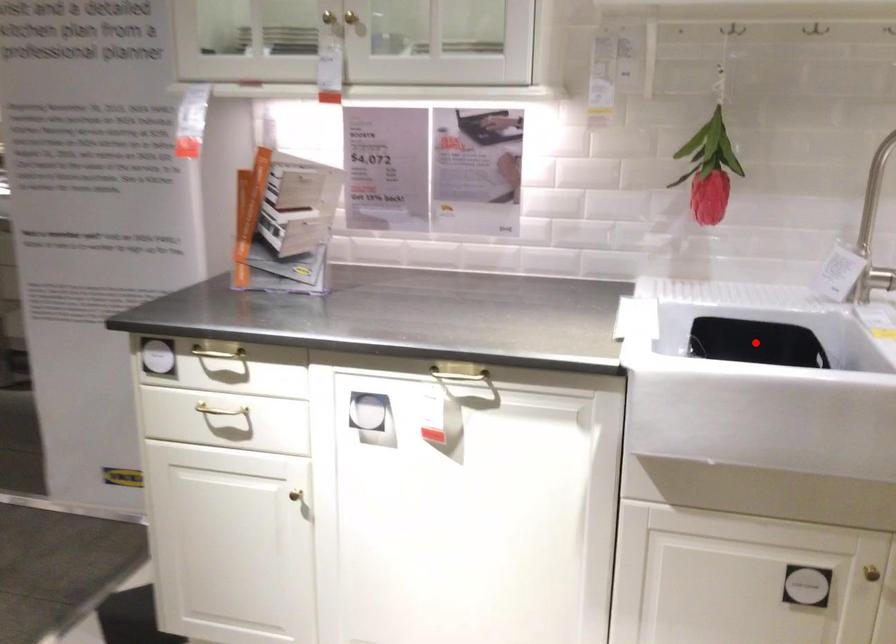
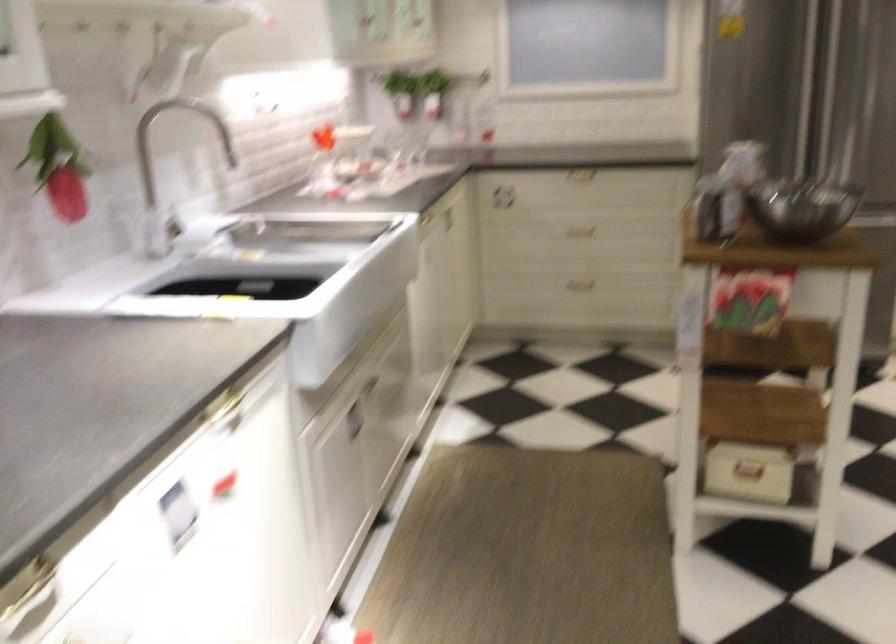
Question: I am providing you with two images of the same scene from different viewpoints. A red point is marked on the first image. At the location where the point appears in image 1, is it still visible in image 2?

Choices:
 (A) Yes
 (B) No

Answer: (B)